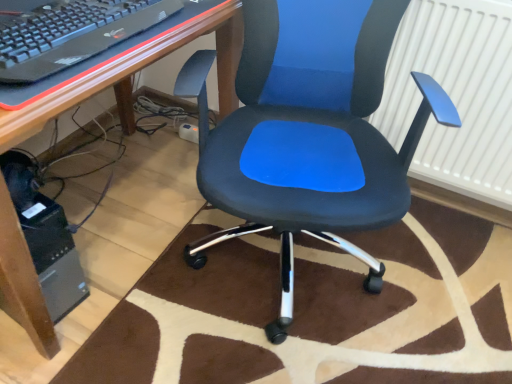
Where is `vacant region below white textured radiator at upper right (from a real-world perspective)`? The width and height of the screenshot is (512, 384). vacant region below white textured radiator at upper right (from a real-world perspective) is located at coordinates (447, 208).